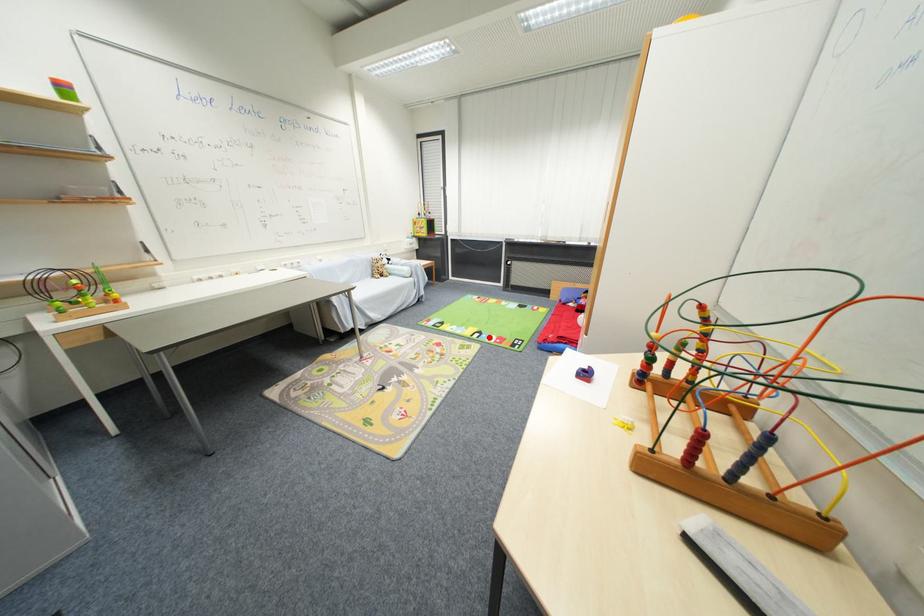
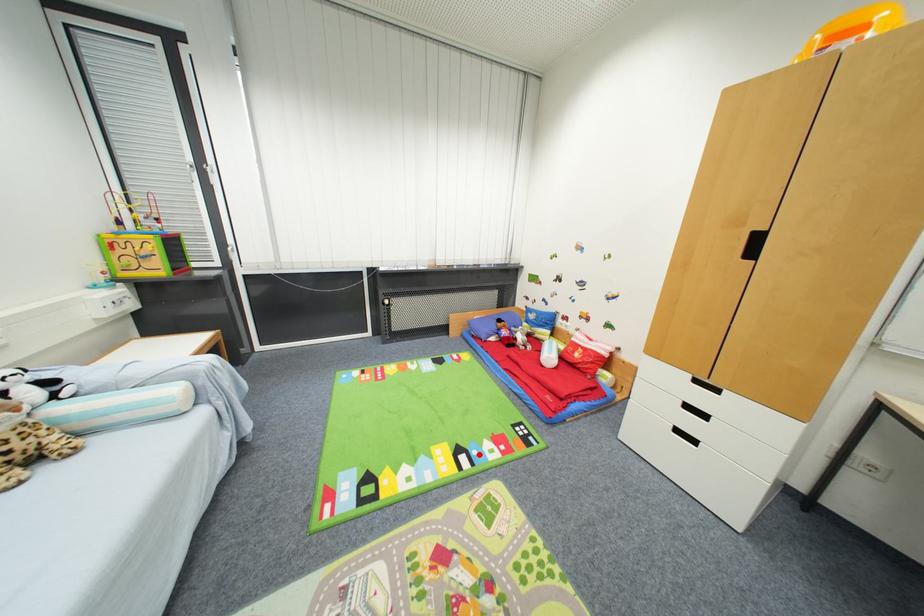
I am providing you with two images of the same scene from different viewpoints. A red point is marked on the first image and another point is marked on the second image. Does the point marked in image1 correspond to the same location as the one in image2?

Yes